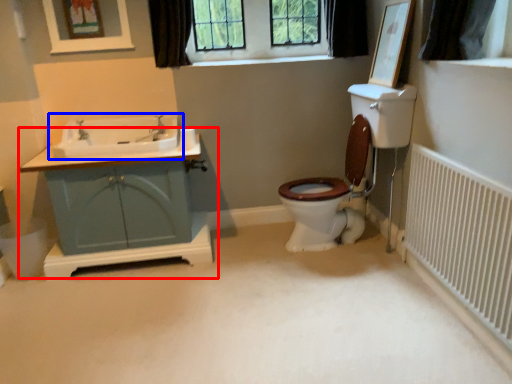
Question: Among these objects, which one is nearest to the camera, bathroom cabinet (highlighted by a red box) or sink (highlighted by a blue box)?

Choices:
 (A) bathroom cabinet
 (B) sink

Answer: (A)